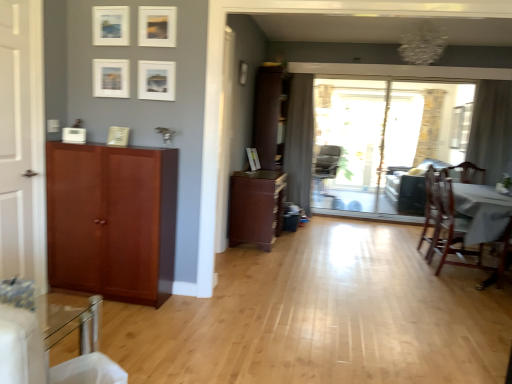
Question: Which direction should I rotate to look at matte white picture frame at upper center, the second picture frame when ordered from front to back?

Choices:
 (A) right
 (B) left

Answer: (B)

Question: From the image's perspective, is white matte picture frame at upper center, positioned as the first picture frame in left-to-right order, over matte white picture frame at center, placed as the first picture frame when sorted from back to front?

Choices:
 (A) yes
 (B) no

Answer: (A)

Question: Is white matte picture frame at upper center, positioned as the first picture frame in left-to-right order, next to matte white picture frame at center, acting as the 1th picture frame starting from the right, and touching it?

Choices:
 (A) no
 (B) yes

Answer: (A)

Question: From the image's perspective, is white matte picture frame at upper center, which is the seventh picture frame in right-to-left order, below matte white picture frame at center, which ranks as the seventh picture frame in front-to-back order?

Choices:
 (A) no
 (B) yes

Answer: (A)

Question: From a real-world perspective, is white matte picture frame at upper center, positioned as the first picture frame in left-to-right order, below matte white picture frame at center, acting as the 1th picture frame starting from the right?

Choices:
 (A) yes
 (B) no

Answer: (B)

Question: Is matte white picture frame at center, acting as the 1th picture frame starting from the right, located within white matte picture frame at upper center, which is the seventh picture frame in right-to-left order?

Choices:
 (A) no
 (B) yes

Answer: (A)

Question: Is white matte picture frame at upper center, which ranks as the third picture frame in back-to-front order, positioned with its back to matte white picture frame at center, acting as the 1th picture frame starting from the right?

Choices:
 (A) yes
 (B) no

Answer: (A)

Question: Is matte white picture frame at center, the 7th picture frame viewed from the left, closer to camera compared to matte white picture frame at upper center, which ranks as the 6th picture frame in right-to-left order?

Choices:
 (A) no
 (B) yes

Answer: (A)

Question: From a real-world perspective, is matte white picture frame at center, the 7th picture frame viewed from the left, beneath matte white picture frame at upper center, which is counted as the 3th picture frame, starting from the front?

Choices:
 (A) yes
 (B) no

Answer: (A)

Question: Does matte white picture frame at center, acting as the 1th picture frame starting from the right, appear on the left side of matte white picture frame at upper center, placed as the fifth picture frame when sorted from back to front?

Choices:
 (A) no
 (B) yes

Answer: (A)

Question: From the image's perspective, is matte white picture frame at center, the 7th picture frame viewed from the left, located above matte white picture frame at upper center, which is counted as the 3th picture frame, starting from the front?

Choices:
 (A) no
 (B) yes

Answer: (A)

Question: Does matte white picture frame at center, the 7th picture frame viewed from the left, have a lesser width compared to matte white picture frame at upper center, which ranks as the 6th picture frame in right-to-left order?

Choices:
 (A) yes
 (B) no

Answer: (B)

Question: Does matte white picture frame at center, placed as the first picture frame when sorted from back to front, have a greater height compared to matte white picture frame at upper center, marked as the second picture frame in a left-to-right arrangement?

Choices:
 (A) yes
 (B) no

Answer: (B)

Question: From the image's perspective, is gray fabric curtain at center, arranged as the first curtain when viewed from the back, located above sheer fabric curtain at right, arranged as the 2th curtain when viewed from the left?

Choices:
 (A) yes
 (B) no

Answer: (B)